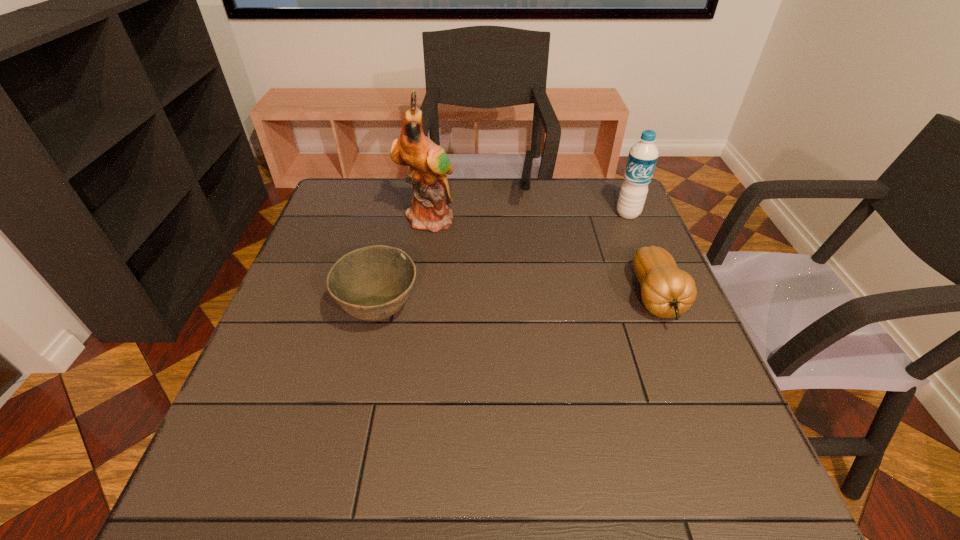
The height and width of the screenshot is (540, 960). Find the location of `gourd present at the right edge`. gourd present at the right edge is located at coordinates (666, 291).

Identify the location of water bottle located at the right edge. The image size is (960, 540). (643, 156).

This screenshot has height=540, width=960. In order to click on object that is at the far right corner in this screenshot , I will do `click(643, 156)`.

At what (x,y) coordinates should I click in order to perform the action: click on free space at the far edge of the desktop. Please return your answer as a coordinate pair (x, y). Looking at the image, I should click on (530, 210).

At what (x,y) coordinates should I click in order to perform the action: click on free space at the near edge of the desktop. Please return your answer as a coordinate pair (x, y). Image resolution: width=960 pixels, height=540 pixels. Looking at the image, I should click on point(402,440).

In the image, there is a desktop. Where is `free space at the left edge`? The width and height of the screenshot is (960, 540). free space at the left edge is located at coordinates (259, 352).

Find the location of a particular element. vacant region at the right edge is located at coordinates (609, 240).

Identify the location of free space at the near left corner. (303, 422).

In order to click on vacant space at the far right corner of the desktop in this screenshot , I will do `click(605, 187)`.

At what (x,y) coordinates should I click in order to perform the action: click on free space between the third object from right to left and the bowl. Please return your answer as a coordinate pair (x, y). This screenshot has width=960, height=540. Looking at the image, I should click on (452, 255).